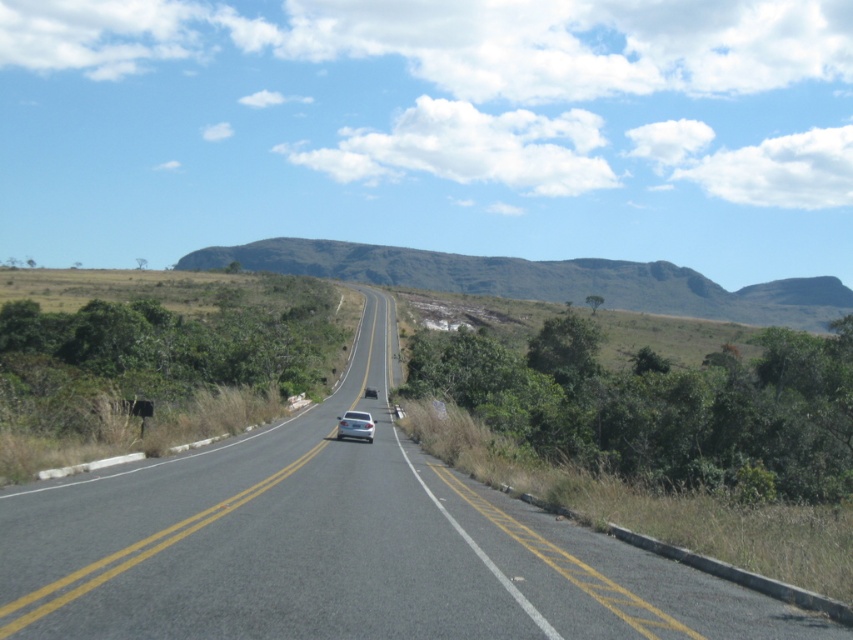
From the picture: Is asphalt road at center taller than silver metallic car at center?

Indeed, asphalt road at center has a greater height compared to silver metallic car at center.

Can you confirm if asphalt road at center is positioned to the right of silver metallic car at center?

No, asphalt road at center is not to the right of silver metallic car at center.

Which is behind, point (25, 528) or point (339, 438)?

Point (339, 438)

Where is `asphalt road at center`? The image size is (853, 640). asphalt road at center is located at coordinates (339, 545).

Does rugged brown mountain at center have a lesser width compared to silver metallic car at center?

No, rugged brown mountain at center is not thinner than silver metallic car at center.

Does point (440, 252) come in front of point (350, 436)?

No, (440, 252) is further to viewer.

Image resolution: width=853 pixels, height=640 pixels. Identify the location of rugged brown mountain at center. (544, 280).

Does asphalt road at center lie behind rugged brown mountain at center?

No, it is in front of rugged brown mountain at center.

Consider the image. Who is higher up, asphalt road at center or rugged brown mountain at center?

rugged brown mountain at center

Is point (108, 513) positioned after point (670, 310)?

No, it is not.

Image resolution: width=853 pixels, height=640 pixels. In order to click on asphalt road at center in this screenshot , I will do `click(339, 545)`.